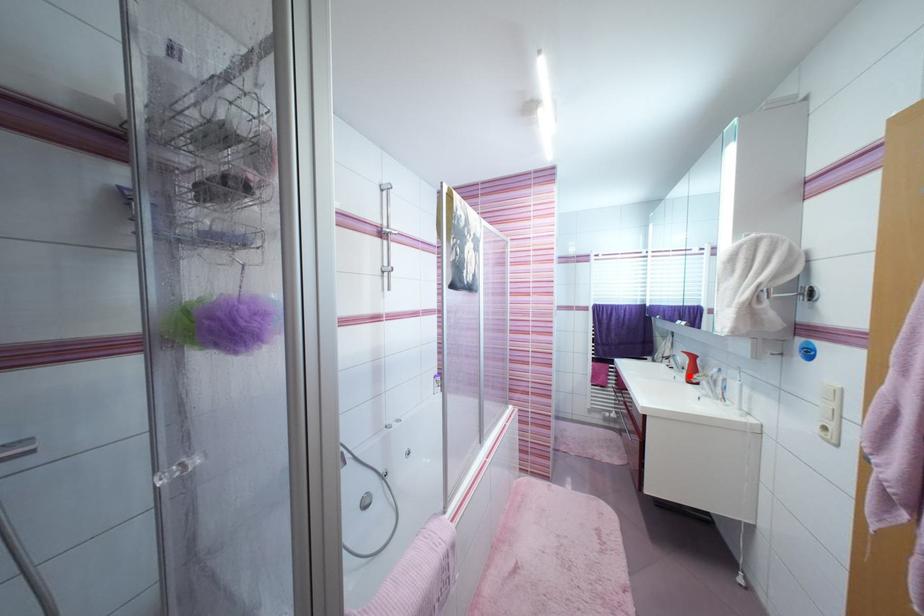
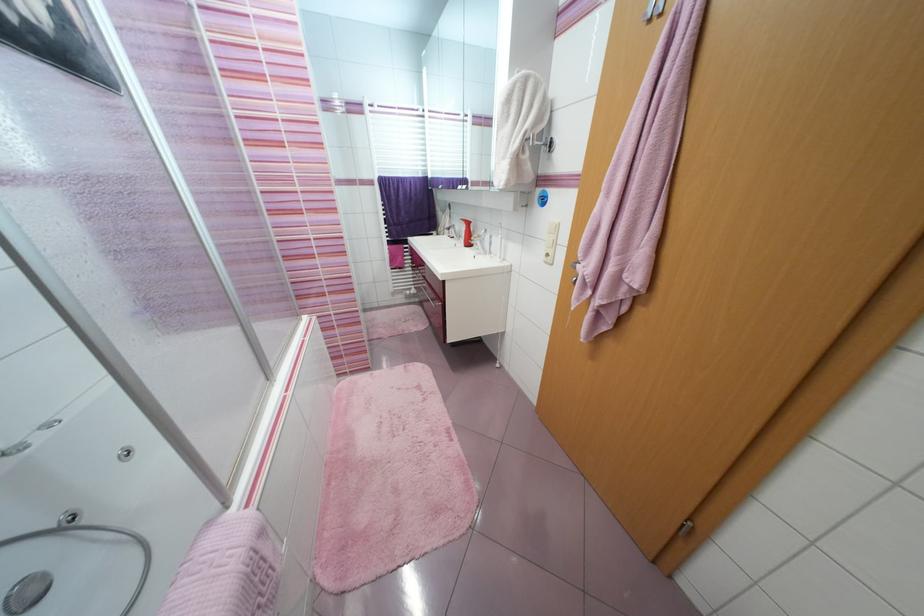
Where in the second image is the point corresponding to the highlighted location from the first image?

(468, 241)